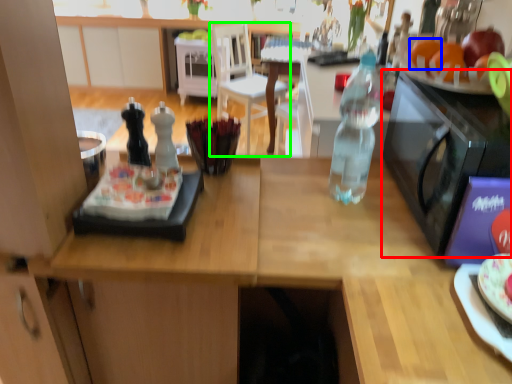
Question: Estimate the real-world distances between objects in this image. Which object is farther from microwave oven (highlighted by a red box), orange (highlighted by a blue box) or chair (highlighted by a green box)?

Choices:
 (A) orange
 (B) chair

Answer: (B)